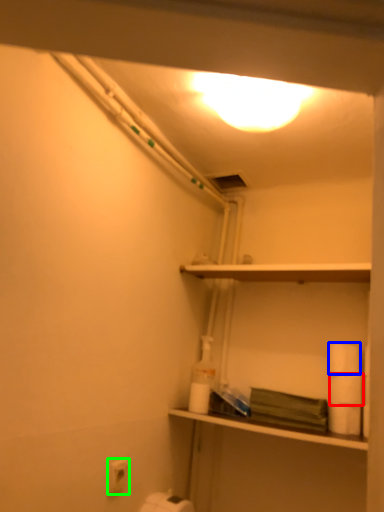
Question: Considering the real-world distances, which object is closest to toilet paper (highlighted by a red box)? toilet paper (highlighted by a blue box) or toilet paper (highlighted by a green box).

Choices:
 (A) toilet paper
 (B) toilet paper

Answer: (A)